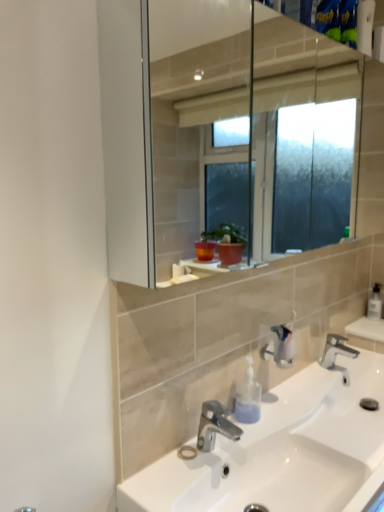
Question: Considering the relative positions of white ceramic sink at center and polished chrome faucet at lower center, which is the first tap from back to front, in the image provided, is white ceramic sink at center to the right of polished chrome faucet at lower center, which is the first tap from back to front, from the viewer's perspective?

Choices:
 (A) no
 (B) yes

Answer: (A)

Question: Are white ceramic sink at center and polished chrome faucet at lower center, positioned as the 1th tap in right-to-left order, making contact?

Choices:
 (A) no
 (B) yes

Answer: (A)

Question: Is white ceramic sink at center completely or partially outside of polished chrome faucet at lower center, which is the first tap from back to front?

Choices:
 (A) yes
 (B) no

Answer: (A)

Question: Is white ceramic sink at center at the left side of polished chrome faucet at lower center, which is the first tap from back to front?

Choices:
 (A) no
 (B) yes

Answer: (B)

Question: Does white ceramic sink at center have a smaller size compared to polished chrome faucet at lower center, which is the first tap from back to front?

Choices:
 (A) no
 (B) yes

Answer: (A)

Question: From the image's perspective, is white ceramic sink at center below polished chrome faucet at lower center, acting as the second tap starting from the left?

Choices:
 (A) yes
 (B) no

Answer: (A)

Question: Is clear plastic soap dispenser at right, which is counted as the second soap dispenser, starting from the front, far away from polished chrome faucet at lower center, which is the second tap in front-to-back order?

Choices:
 (A) no
 (B) yes

Answer: (A)

Question: Considering the relative sizes of clear plastic soap dispenser at right, the first soap dispenser in the top-to-bottom sequence, and polished chrome faucet at lower center, which is the second tap in front-to-back order, in the image provided, is clear plastic soap dispenser at right, the first soap dispenser in the top-to-bottom sequence, shorter than polished chrome faucet at lower center, which is the second tap in front-to-back order,?

Choices:
 (A) yes
 (B) no

Answer: (B)

Question: Is clear plastic soap dispenser at right, marked as the 1th soap dispenser in a back-to-front arrangement, to the left of polished chrome faucet at lower center, which is the second tap in front-to-back order, from the viewer's perspective?

Choices:
 (A) yes
 (B) no

Answer: (B)

Question: Is clear plastic soap dispenser at right, the first soap dispenser in the top-to-bottom sequence, directly adjacent to polished chrome faucet at lower center, acting as the second tap starting from the left?

Choices:
 (A) yes
 (B) no

Answer: (B)

Question: Is the position of clear plastic soap dispenser at right, marked as the 1th soap dispenser in a back-to-front arrangement, less distant than that of polished chrome faucet at lower center, acting as the second tap starting from the left?

Choices:
 (A) no
 (B) yes

Answer: (A)

Question: From a real-world perspective, is clear plastic soap dispenser at right, marked as the 1th soap dispenser in a back-to-front arrangement, positioned over polished chrome faucet at lower center, positioned as the 1th tap in right-to-left order, based on gravity?

Choices:
 (A) yes
 (B) no

Answer: (A)

Question: Is polished chrome faucet at lower center, which is the first tap from back to front, at the left side of white ceramic sink at center?

Choices:
 (A) no
 (B) yes

Answer: (A)